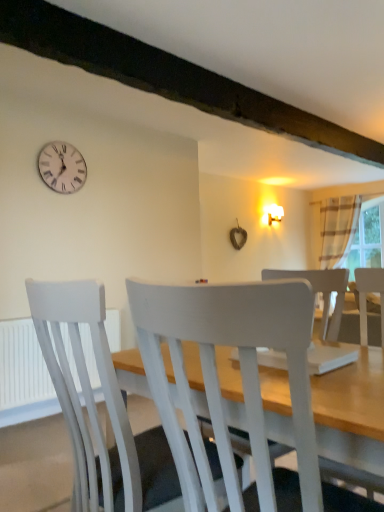
Question: Is striped fabric curtain at right wider or thinner than white painted wood chair at center, the first chair from the back?

Choices:
 (A) thin
 (B) wide

Answer: (A)

Question: Relative to white painted wood chair at center, the first chair from the back, is striped fabric curtain at right in front or behind?

Choices:
 (A) front
 (B) behind

Answer: (B)

Question: Which is nearer to the white painted wood chair at center, which appears as the second chair when viewed from the back?

Choices:
 (A) clear glass window at right
 (B) white plastic clock at upper left
 (C) white painted wood chair at center, the first chair from the back
 (D) white plastic radiator at lower left
 (E) striped fabric curtain at right

Answer: (C)

Question: Based on their relative distances, which object is nearer to the white plastic clock at upper left?

Choices:
 (A) clear glass window at right
 (B) white painted wood chair at center, placed as the second chair when sorted from front to back
 (C) white plastic radiator at lower left
 (D) striped fabric curtain at right
 (E) white painted wood chair at center, the 1th chair in the front-to-back sequence

Answer: (C)